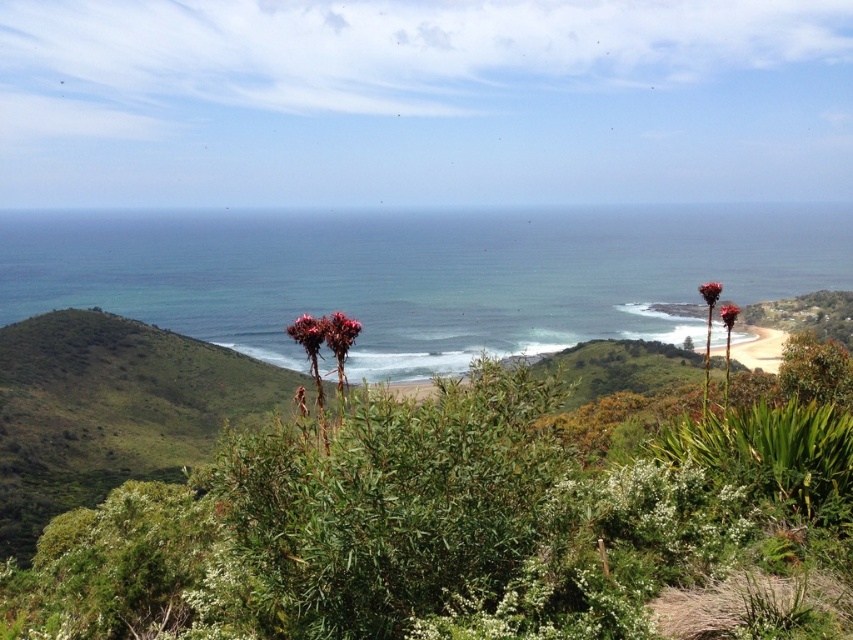
In the scene shown: Does green leafy shrubs at center have a greater width compared to blue-green water at center?

In fact, green leafy shrubs at center might be narrower than blue-green water at center.

Who is lower down, green leafy shrubs at center or blue-green water at center?

green leafy shrubs at center

Between point (30, 614) and point (126, 300), which one is positioned behind?

Positioned behind is point (126, 300).

You are a GUI agent. You are given a task and a screenshot of the screen. Output one action in this format:
    pyautogui.click(x=<x>, y=<y>)
    Task: Click on the green leafy shrubs at center
    The height and width of the screenshot is (640, 853).
    Given the screenshot: What is the action you would take?
    pyautogui.click(x=461, y=525)

Between blue-green water at center and bumpy red flower at center, which one is positioned lower?

bumpy red flower at center is below.

Can you confirm if blue-green water at center is positioned to the right of bumpy red flower at center?

Incorrect, blue-green water at center is not on the right side of bumpy red flower at center.

Which is behind, point (206, 248) or point (360, 326)?

Positioned behind is point (206, 248).

Identify the location of blue-green water at center. (421, 275).

Can you confirm if blue-green water at center is wider than bumpy coral-like plant at center?

Indeed, blue-green water at center has a greater width compared to bumpy coral-like plant at center.

You are a GUI agent. You are given a task and a screenshot of the screen. Output one action in this format:
    pyautogui.click(x=<x>, y=<y>)
    Task: Click on the blue-green water at center
    The image size is (853, 640).
    Given the screenshot: What is the action you would take?
    pyautogui.click(x=421, y=275)